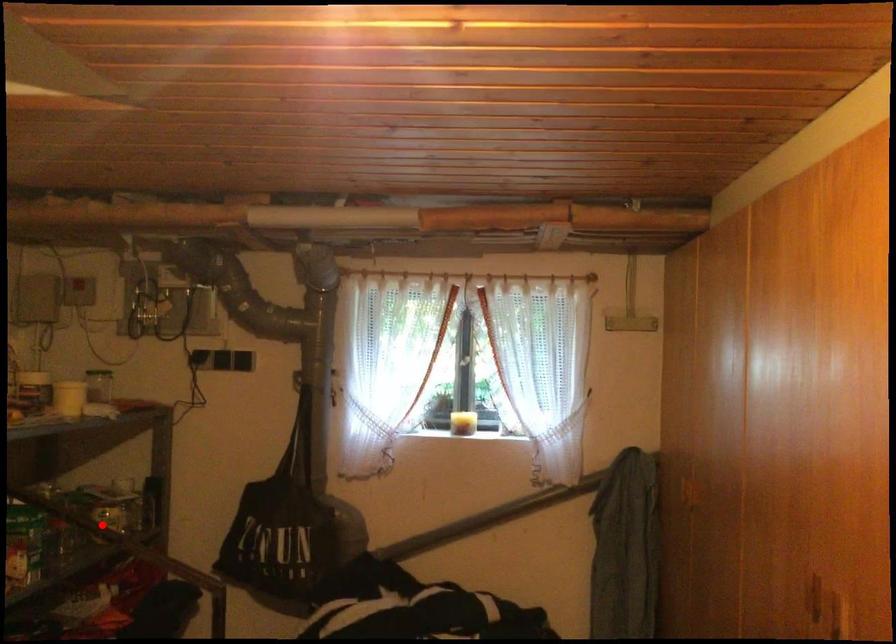
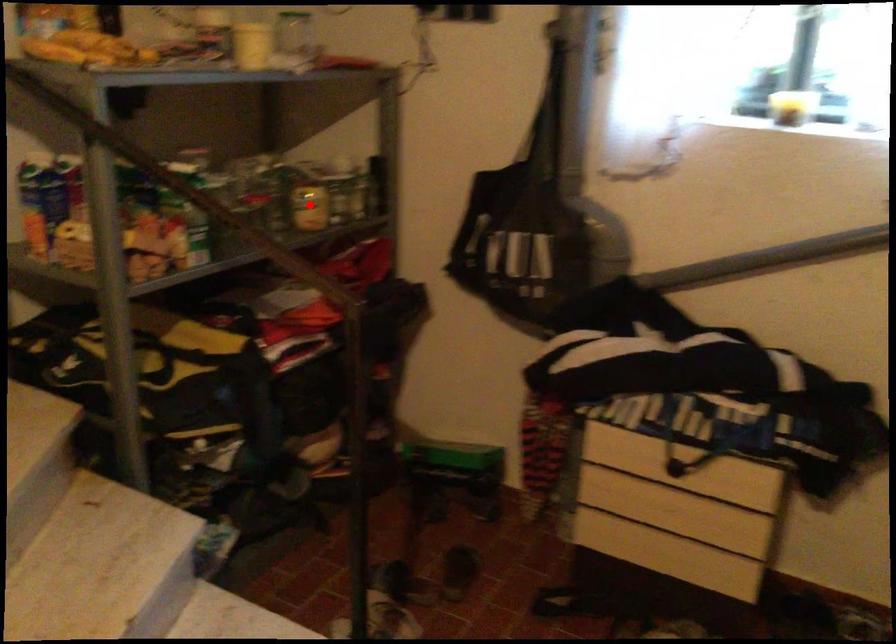
Looking at this image, I am providing you with two images of the same scene from different viewpoints. A red point is marked on the first image and another point is marked on the second image. Is the red point in image1 aligned with the point shown in image2?

Yes